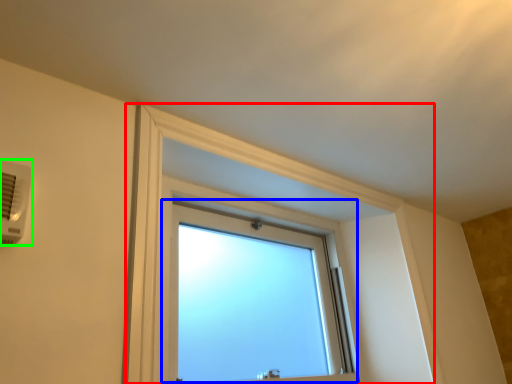
Question: Based on their relative distances, which object is farther from bay window (highlighted by a red box)? Choose from window (highlighted by a blue box) and air conditioning (highlighted by a green box).

Choices:
 (A) window
 (B) air conditioning

Answer: (B)